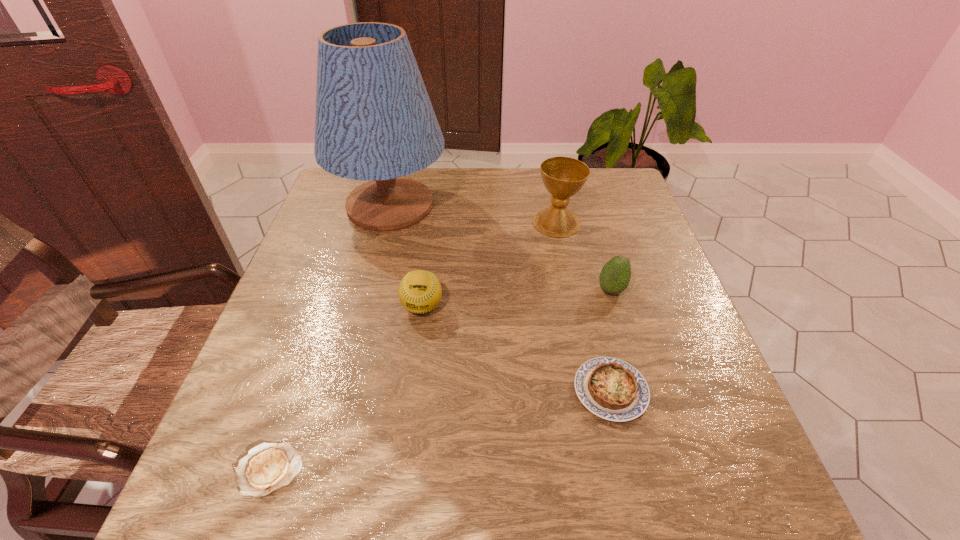
Find the location of a particular element. vacant space located on the left of the avocado is located at coordinates [433, 290].

The width and height of the screenshot is (960, 540). I want to click on free space located on the logo side of the softball, so click(407, 426).

This screenshot has height=540, width=960. Identify the location of free location located 0.320m on the back of the farther quiche. (578, 255).

The height and width of the screenshot is (540, 960). Identify the location of vacant area situated 0.210m on the back of the shorter quiche. (312, 346).

At what (x,y) coordinates should I click in order to perform the action: click on lampshade that is at the far edge. Please return your answer as a coordinate pair (x, y). This screenshot has height=540, width=960. Looking at the image, I should click on (374, 121).

Image resolution: width=960 pixels, height=540 pixels. I want to click on chalice positioned at the far edge, so click(563, 177).

Where is `object situated at the near edge`? object situated at the near edge is located at coordinates (267, 467).

The image size is (960, 540). I want to click on lampshade that is at the left edge, so click(x=374, y=121).

You are a GUI agent. You are given a task and a screenshot of the screen. Output one action in this format:
    pyautogui.click(x=<x>, y=<y>)
    Task: Click on the quiche positioned at the left edge
    The height and width of the screenshot is (540, 960).
    Given the screenshot: What is the action you would take?
    pyautogui.click(x=267, y=467)

Find the location of a particular element. The height and width of the screenshot is (540, 960). avocado that is at the right edge is located at coordinates (615, 275).